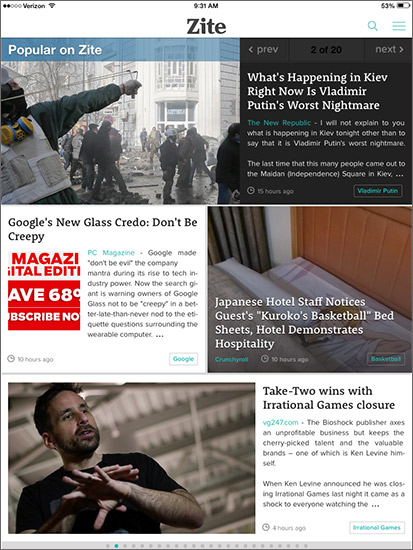
Locate an element on the screen. Image resolution: width=413 pixels, height=550 pixels. bed is located at coordinates (295, 285).